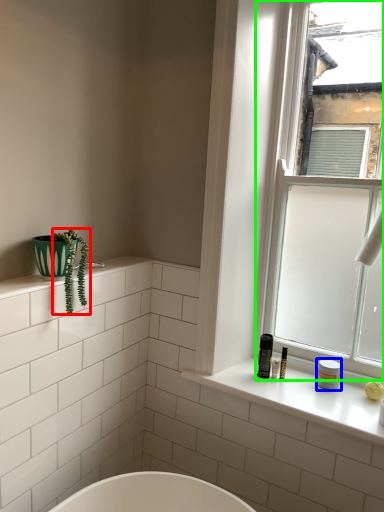
Question: Which object is positioned closest to plant (highlighted by a red box)? Select from toiletry (highlighted by a blue box) and window (highlighted by a green box).

Choices:
 (A) toiletry
 (B) window

Answer: (A)